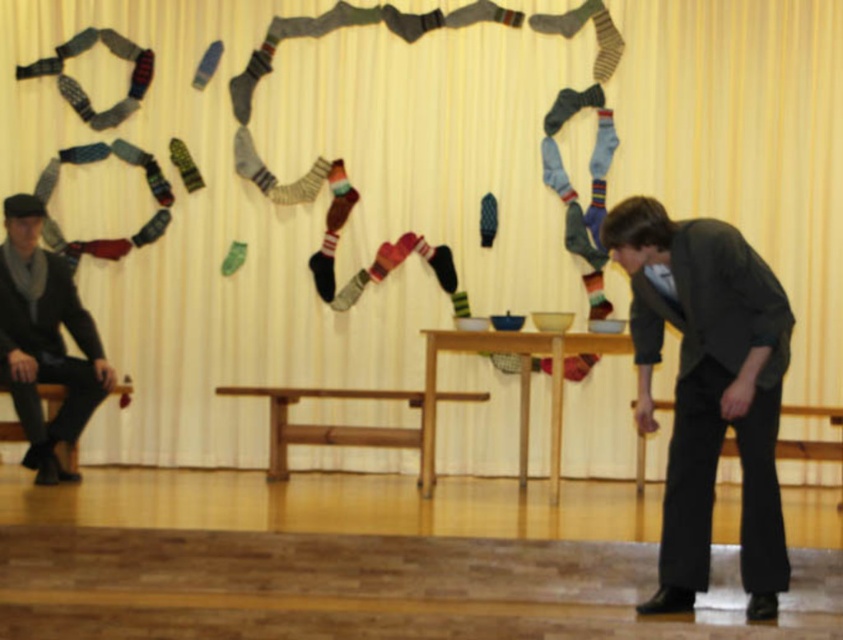
Question: In this image, where is matte black suit at left located relative to wooden stool at left?

Choices:
 (A) above
 (B) below

Answer: (A)

Question: Which object is farther from the camera taking this photo?

Choices:
 (A) wooden stool at left
 (B) dark gray suit at right
 (C) striped wool sock at center
 (D) matte black suit at left

Answer: (C)

Question: Which point is closer to the camera?

Choices:
 (A) (363, 436)
 (B) (545, 76)
 (C) (44, 282)
 (D) (693, 570)

Answer: (D)

Question: Considering the real-world distances, which object is closest to the dark gray suit at right?

Choices:
 (A) matte black suit at left
 (B) wooden bench at center
 (C) wooden stool at left
 (D) matte yellow curtain at upper center

Answer: (B)

Question: Does matte yellow curtain at upper center appear over wooden bench at center?

Choices:
 (A) no
 (B) yes

Answer: (B)

Question: Is dark gray suit at right positioned in front of wooden bench at center?

Choices:
 (A) no
 (B) yes

Answer: (B)